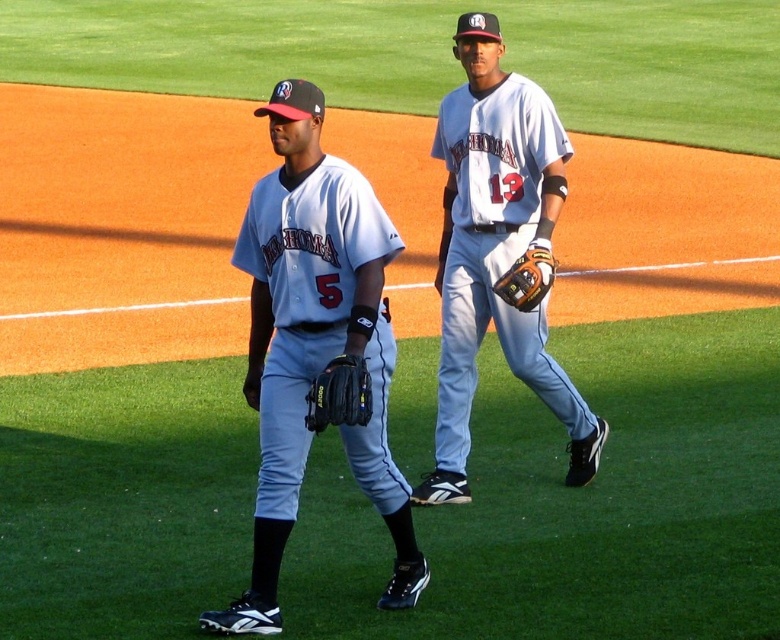
Question: Which object appears closest to the camera in this image?

Choices:
 (A) brown leather glove at center
 (B) black leather baseball glove at lower center

Answer: (B)

Question: Can you confirm if matte gray uniform at center is positioned above white matte baseball glove at center?

Choices:
 (A) no
 (B) yes

Answer: (A)

Question: Is matte gray uniform at center below brown leather glove at center?

Choices:
 (A) yes
 (B) no

Answer: (A)

Question: Which object is closer to the camera taking this photo?

Choices:
 (A) black leather baseball glove at lower center
 (B) brown leather glove at center
 (C) white matte baseball glove at center

Answer: (A)

Question: Can you confirm if matte gray uniform at center is positioned to the left of black leather baseball glove at lower center?

Choices:
 (A) yes
 (B) no

Answer: (A)

Question: Among these objects, which one is farthest from the camera?

Choices:
 (A) matte gray uniform at center
 (B) black leather baseball glove at lower center

Answer: (A)